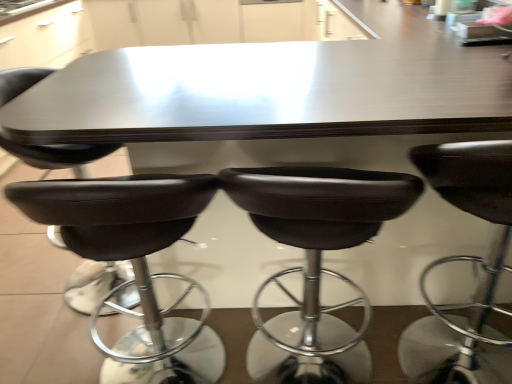
What is the approximate width of black leather chair at lower left, marked as the fourth chair in a right-to-left arrangement?

black leather chair at lower left, marked as the fourth chair in a right-to-left arrangement, is 46.28 centimeters wide.

What do you see at coordinates (315, 263) in the screenshot? The width and height of the screenshot is (512, 384). I see `black leather stool at center, marked as the 2th chair in a right-to-left arrangement` at bounding box center [315, 263].

Identify the location of black leather stool at lower left, positioned as the fifth chair in right-to-left order. This screenshot has height=384, width=512. (59, 154).

The width and height of the screenshot is (512, 384). What do you see at coordinates (59, 154) in the screenshot?
I see `black leather stool at lower left, the first chair in the left-to-right sequence` at bounding box center [59, 154].

Where is `black leather stool at center, the 3th chair positioned from the left`? The width and height of the screenshot is (512, 384). black leather stool at center, the 3th chair positioned from the left is located at coordinates (135, 266).

Can you tell me how much black leather stool at center, which is counted as the fourth chair, starting from the left, and black leather chair at lower left, marked as the fourth chair in a right-to-left arrangement, differ in facing direction?

The facing directions of black leather stool at center, which is counted as the fourth chair, starting from the left, and black leather chair at lower left, marked as the fourth chair in a right-to-left arrangement, are 90 degrees apart.

From the image's perspective, is black leather stool at center, which is counted as the fourth chair, starting from the left, located beneath black leather chair at lower left, marked as the fourth chair in a right-to-left arrangement?

Yes.

How far apart are black leather stool at center, which is counted as the fourth chair, starting from the left, and black leather chair at lower left, marked as the fourth chair in a right-to-left arrangement?

A distance of 28.84 inches exists between black leather stool at center, which is counted as the fourth chair, starting from the left, and black leather chair at lower left, marked as the fourth chair in a right-to-left arrangement.

Is black leather stool at center, which is counted as the fourth chair, starting from the left, beside black leather chair at lower left, marked as the fourth chair in a right-to-left arrangement?

No.

In the scene shown: Which is less distant, (68, 296) or (24, 158)?

Clearly, point (68, 296) is more distant from the camera than point (24, 158).

Is black leather chair at lower left, marked as the fourth chair in a right-to-left arrangement, not within black leather stool at lower left, the first chair in the left-to-right sequence?

That's correct, black leather chair at lower left, marked as the fourth chair in a right-to-left arrangement, is outside of black leather stool at lower left, the first chair in the left-to-right sequence.

In the image, is black leather chair at lower left, marked as the fourth chair in a right-to-left arrangement, on the left side or the right side of black leather stool at lower left, positioned as the fifth chair in right-to-left order?

Based on their positions, black leather chair at lower left, marked as the fourth chair in a right-to-left arrangement, is located to the right of black leather stool at lower left, positioned as the fifth chair in right-to-left order.

Is black leather stool at lower left, positioned as the fifth chair in right-to-left order, in front of or behind black leather stool at center, marked as the 2th chair in a right-to-left arrangement, in the image?

Clearly, black leather stool at lower left, positioned as the fifth chair in right-to-left order, is behind black leather stool at center, marked as the 2th chair in a right-to-left arrangement.

Who is bigger, black leather stool at lower left, positioned as the fifth chair in right-to-left order, or black leather stool at center, marked as the 2th chair in a right-to-left arrangement?

black leather stool at lower left, positioned as the fifth chair in right-to-left order, is bigger.

Is black leather stool at lower left, the first chair in the left-to-right sequence, located outside black leather stool at center, marked as the 2th chair in a right-to-left arrangement?

Yes, black leather stool at lower left, the first chair in the left-to-right sequence, is outside of black leather stool at center, marked as the 2th chair in a right-to-left arrangement.

Is black leather stool at lower left, the first chair in the left-to-right sequence, facing towards black leather stool at center, marked as the 2th chair in a right-to-left arrangement?

No, black leather stool at lower left, the first chair in the left-to-right sequence, does not turn towards black leather stool at center, marked as the 2th chair in a right-to-left arrangement.

Which object is further away from the camera taking this photo, black leather stool at center, marked as the 2th chair in a right-to-left arrangement, or black leather stool at lower left, the first chair in the left-to-right sequence?

black leather stool at lower left, the first chair in the left-to-right sequence, is behind.

Looking at this image, is black leather stool at center, which is counted as the fourth chair, starting from the left, turned away from black leather stool at lower left, positioned as the fifth chair in right-to-left order?

No, black leather stool at center, which is counted as the fourth chair, starting from the left, is not facing the opposite direction of black leather stool at lower left, positioned as the fifth chair in right-to-left order.

Is black leather stool at center, marked as the 2th chair in a right-to-left arrangement, shorter than black leather stool at lower left, positioned as the fifth chair in right-to-left order?

Yes, black leather stool at center, marked as the 2th chair in a right-to-left arrangement, is shorter than black leather stool at lower left, positioned as the fifth chair in right-to-left order.

The width and height of the screenshot is (512, 384). Identify the location of the 3rd chair behind the black leather stool at center, which is counted as the fourth chair, starting from the left. (59, 154).

Which of these two, black leather stool at center, which is the third chair from right to left, or black leather chair at lower left, the second chair when ordered from left to right, is wider?

black leather chair at lower left, the second chair when ordered from left to right.

From the image's perspective, is black leather stool at center, the 3th chair positioned from the left, located above or below black leather chair at lower left, marked as the fourth chair in a right-to-left arrangement?

Clearly, from the image's perspective, black leather stool at center, the 3th chair positioned from the left, is below black leather chair at lower left, marked as the fourth chair in a right-to-left arrangement.

Is black leather stool at center, the 3th chair positioned from the left, further to the viewer compared to black leather chair at lower left, the second chair when ordered from left to right?

No, the depth of black leather stool at center, the 3th chair positioned from the left, is less than that of black leather chair at lower left, the second chair when ordered from left to right.

From a real-world perspective, between black leather stool at center, which is the third chair from right to left, and black leather chair at lower left, marked as the fourth chair in a right-to-left arrangement, who is vertically higher?

black leather chair at lower left, marked as the fourth chair in a right-to-left arrangement, is physically above.

The image size is (512, 384). Identify the location of the 2nd chair below the black leather chair at lower left, marked as the fourth chair in a right-to-left arrangement (from a real-world perspective). (315, 263).

Does black leather chair at lower left, the second chair when ordered from left to right, have a larger size compared to black leather stool at center, which is counted as the fourth chair, starting from the left?

Correct, black leather chair at lower left, the second chair when ordered from left to right, is larger in size than black leather stool at center, which is counted as the fourth chair, starting from the left.

Is black leather chair at lower left, the second chair when ordered from left to right, next to black leather stool at center, marked as the 2th chair in a right-to-left arrangement, and touching it?

black leather chair at lower left, the second chair when ordered from left to right, and black leather stool at center, marked as the 2th chair in a right-to-left arrangement, are clearly separated.

Can you confirm if black leather stool at center, the fifth chair when ordered from left to right, is taller than black leather stool at lower left, the first chair in the left-to-right sequence?

No.

Which object is more forward, black leather stool at center, placed as the first chair when sorted from right to left, or black leather stool at lower left, the first chair in the left-to-right sequence?

black leather stool at center, placed as the first chair when sorted from right to left, is closer to the camera.

In the scene shown: Is black leather stool at center, placed as the first chair when sorted from right to left, far away from black leather stool at lower left, the first chair in the left-to-right sequence?

Yes.

From a real-world perspective, which chair is the 2nd one above the black leather stool at center, marked as the 2th chair in a right-to-left arrangement? Please provide its 2D coordinates.

[(59, 155)]

Identify the location of chair on the left of the black leather chair at lower left, the second chair when ordered from left to right. This screenshot has height=384, width=512. (59, 154).

Looking at the image, which one is located further to black leather stool at center, which is counted as the fourth chair, starting from the left, black leather stool at center, placed as the first chair when sorted from right to left, or black leather stool at center, the 3th chair positioned from the left?

black leather stool at center, the 3th chair positioned from the left, is positioned further to the anchor black leather stool at center, which is counted as the fourth chair, starting from the left.

When comparing their distances from black leather stool at lower left, positioned as the fifth chair in right-to-left order, does black leather chair at lower left, marked as the fourth chair in a right-to-left arrangement, or black leather stool at center, which is the third chair from right to left, seem further?

black leather chair at lower left, marked as the fourth chair in a right-to-left arrangement.

From the image, which object appears to be nearer to black leather chair at lower left, marked as the fourth chair in a right-to-left arrangement, black leather stool at center, the fifth chair when ordered from left to right, or black leather stool at center, marked as the 2th chair in a right-to-left arrangement?

black leather stool at center, marked as the 2th chair in a right-to-left arrangement, is positioned closer to the anchor black leather chair at lower left, marked as the fourth chair in a right-to-left arrangement.

Which object lies further to the anchor point black leather stool at center, marked as the 2th chair in a right-to-left arrangement, black leather stool at center, the 3th chair positioned from the left, or black leather chair at lower left, the second chair when ordered from left to right?

black leather chair at lower left, the second chair when ordered from left to right, is further to black leather stool at center, marked as the 2th chair in a right-to-left arrangement.

Estimate the real-world distances between objects in this image. Which object is further from black leather stool at center, which is the third chair from right to left, black leather stool at center, the fifth chair when ordered from left to right, or black leather stool at center, which is counted as the fourth chair, starting from the left?

black leather stool at center, the fifth chair when ordered from left to right, lies further to black leather stool at center, which is the third chair from right to left, than the other object.

When comparing their distances from black leather stool at lower left, the first chair in the left-to-right sequence, does black leather chair at lower left, marked as the fourth chair in a right-to-left arrangement, or black leather stool at center, placed as the first chair when sorted from right to left, seem further?

Among the two, black leather stool at center, placed as the first chair when sorted from right to left, is located further to black leather stool at lower left, the first chair in the left-to-right sequence.

When comparing their distances from black leather chair at lower left, marked as the fourth chair in a right-to-left arrangement, does black leather stool at lower left, the first chair in the left-to-right sequence, or black leather stool at center, which is counted as the fourth chair, starting from the left, seem further?

The object further to black leather chair at lower left, marked as the fourth chair in a right-to-left arrangement, is black leather stool at center, which is counted as the fourth chair, starting from the left.

When comparing their distances from black leather stool at lower left, positioned as the fifth chair in right-to-left order, does black leather chair at lower left, the second chair when ordered from left to right, or black leather stool at center, which is counted as the fourth chair, starting from the left, seem further?

The object further to black leather stool at lower left, positioned as the fifth chair in right-to-left order, is black leather stool at center, which is counted as the fourth chair, starting from the left.

Where is `chair located between black leather chair at lower left, marked as the fourth chair in a right-to-left arrangement, and black leather stool at center, marked as the 2th chair in a right-to-left arrangement, in the left-right direction`? chair located between black leather chair at lower left, marked as the fourth chair in a right-to-left arrangement, and black leather stool at center, marked as the 2th chair in a right-to-left arrangement, in the left-right direction is located at coordinates (135, 266).

At what (x,y) coordinates should I click in order to perform the action: click on chair situated between black leather stool at lower left, positioned as the fifth chair in right-to-left order, and black leather stool at center, the 3th chair positioned from the left, from left to right. Please return your answer as a coordinate pair (x, y). Looking at the image, I should click on coord(59,155).

Find the location of a particular element. This screenshot has height=384, width=512. chair situated between black leather stool at center, which is the third chair from right to left, and black leather stool at center, placed as the first chair when sorted from right to left, from left to right is located at coordinates (315, 263).